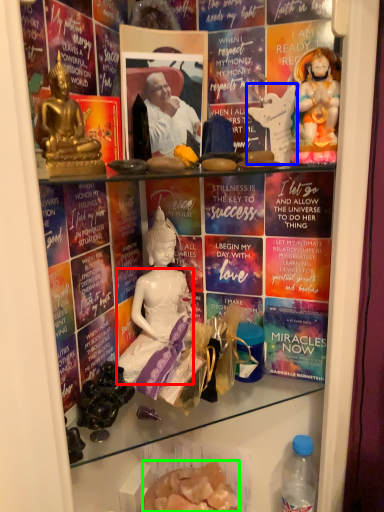
Question: Based on their relative distances, which object is farther from fancy dress (highlighted by a red box)? Choose from sculpture (highlighted by a blue box) and food (highlighted by a green box).

Choices:
 (A) sculpture
 (B) food

Answer: (A)